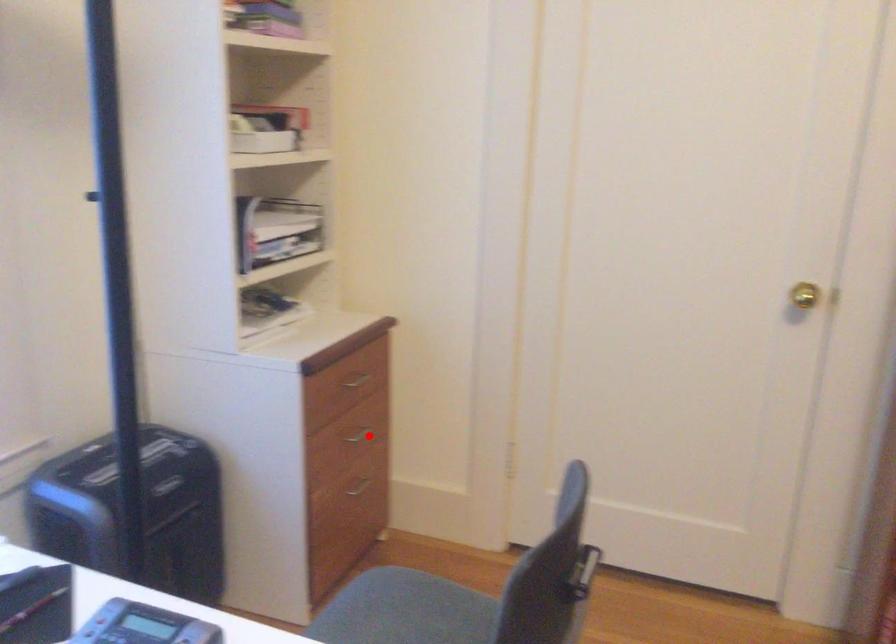
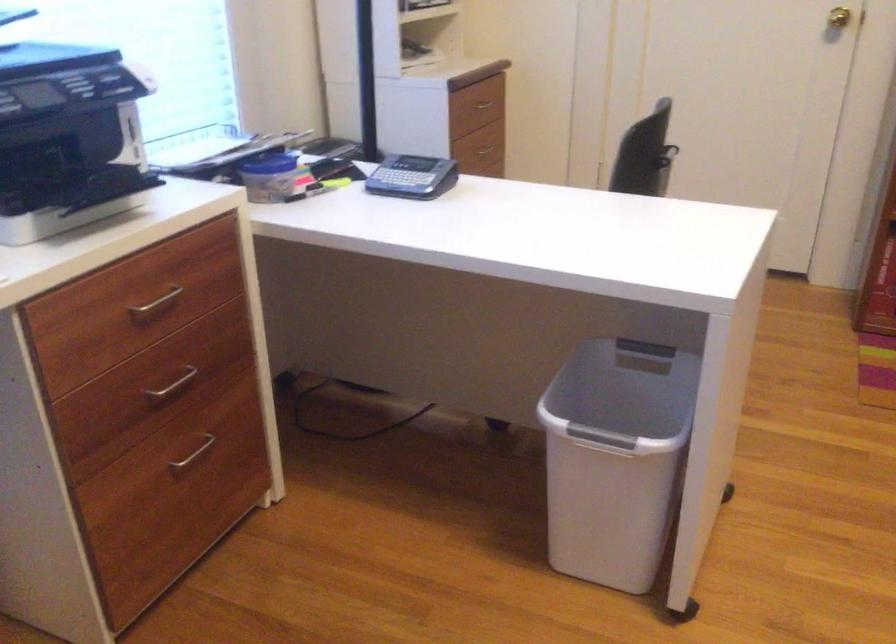
Question: I am providing you with two images of the same scene from different viewpoints. Image1 has a red point marked. In image2, the corresponding 3D location appears at what relative position? Reply with the corresponding letter.

Choices:
 (A) Closer
 (B) Farther

Answer: (B)